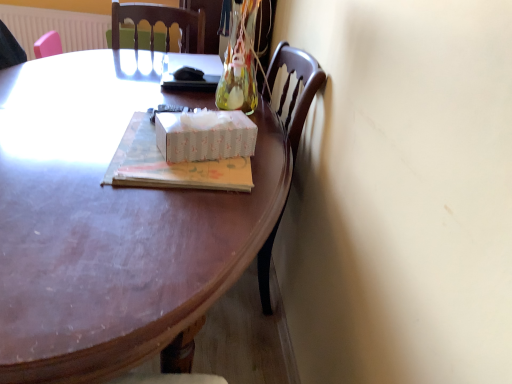
Locate an element on the screen. This screenshot has width=512, height=384. vacant area that is in front of white paper tissue box at center is located at coordinates (195, 197).